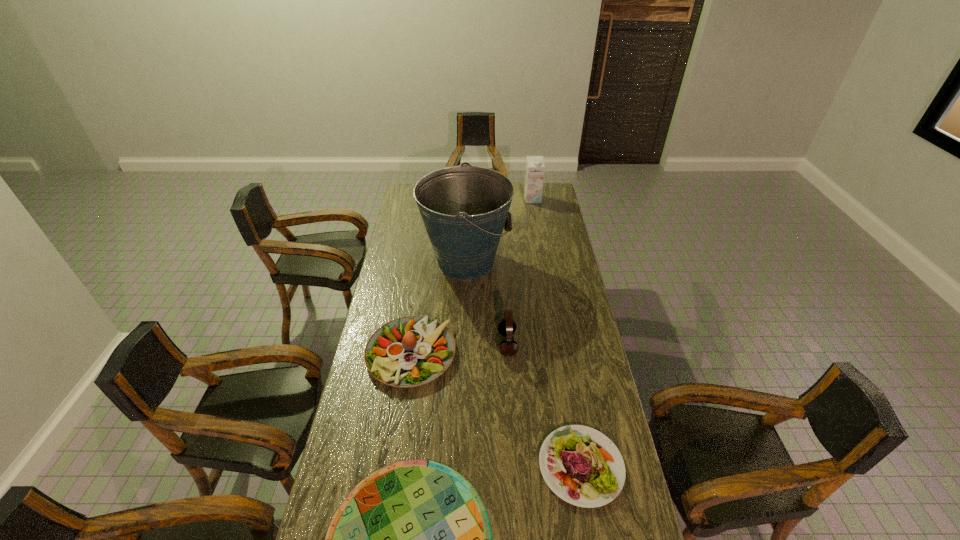
Identify the location of vacant space situated on the front of the carton. The width and height of the screenshot is (960, 540). point(537,221).

The image size is (960, 540). In order to click on vacant space situated on the ear pads of the fourth shortest object in this screenshot , I will do `click(460, 343)`.

Locate an element on the screen. This screenshot has height=540, width=960. vacant space located 0.240m on the ear pads of the fourth shortest object is located at coordinates (438, 343).

Where is `vacant space situated on the ear pads of the fourth shortest object`? vacant space situated on the ear pads of the fourth shortest object is located at coordinates 415,343.

Find the location of a particular element. vacant point located 0.050m on the back of the farther salad plate is located at coordinates (417, 313).

This screenshot has width=960, height=540. Find the location of `vacant space situated on the back of the nearer salad plate`. vacant space situated on the back of the nearer salad plate is located at coordinates (569, 397).

Where is `object located at the far edge`? The width and height of the screenshot is (960, 540). object located at the far edge is located at coordinates (534, 177).

The height and width of the screenshot is (540, 960). Find the location of `object that is at the left edge`. object that is at the left edge is located at coordinates (410, 351).

Where is `carton present at the right edge`? carton present at the right edge is located at coordinates (534, 177).

I want to click on salad plate at the right edge, so click(582, 466).